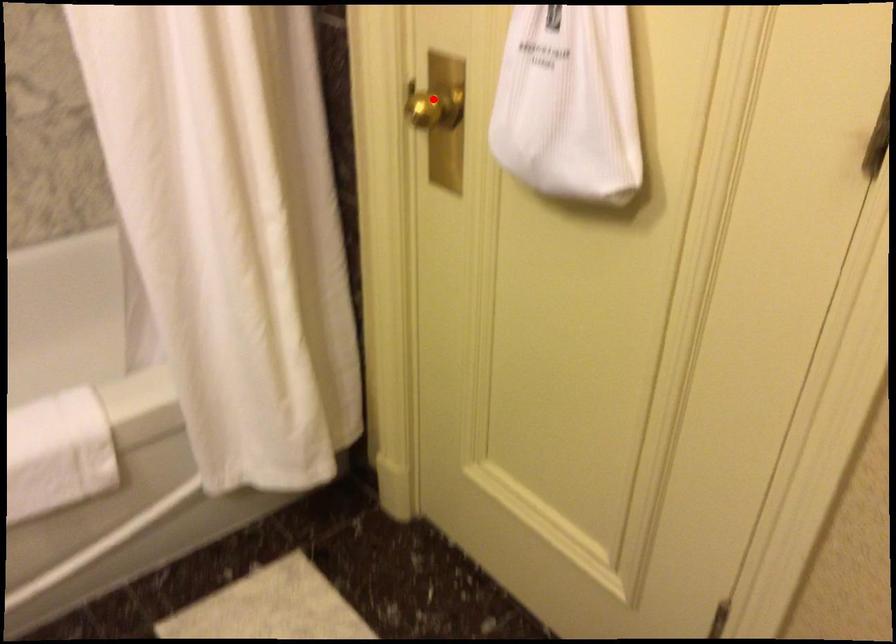
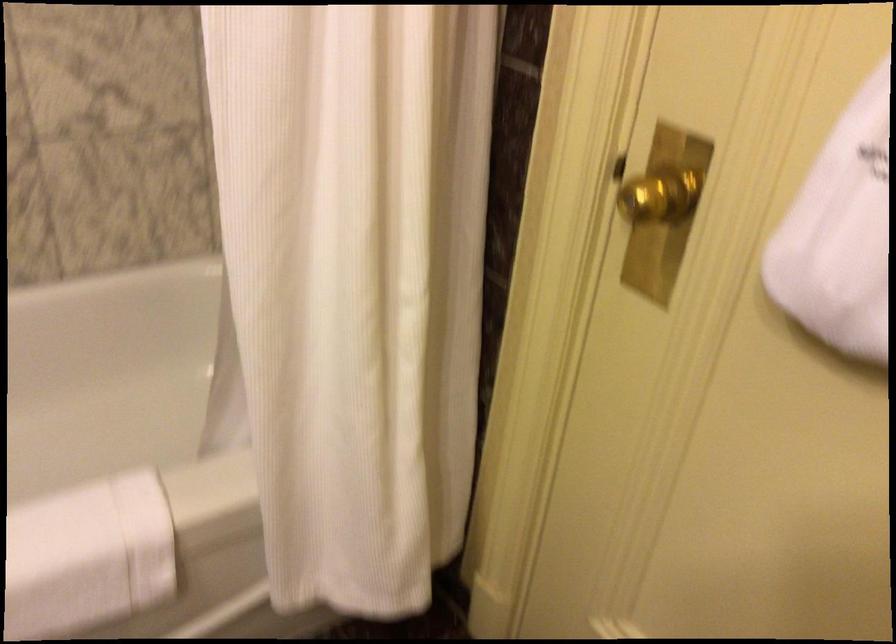
Question: I am providing you with two images of the same scene from different viewpoints. A red point is shown in image1. For the corresponding object point in image2, is it positioned nearer or farther from the camera?

Choices:
 (A) Nearer
 (B) Farther

Answer: (A)